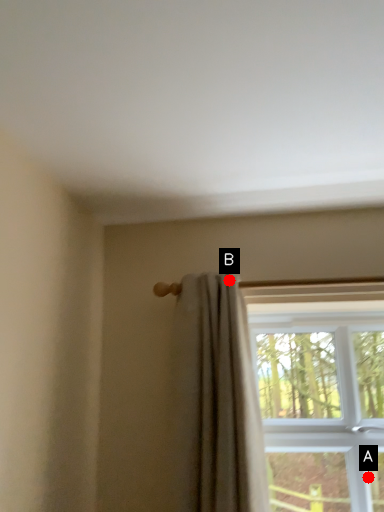
Question: Two points are circled on the image, labeled by A and B beside each circle. Which point appears closest to the camera in this image?

Choices:
 (A) A is closer
 (B) B is closer

Answer: (B)